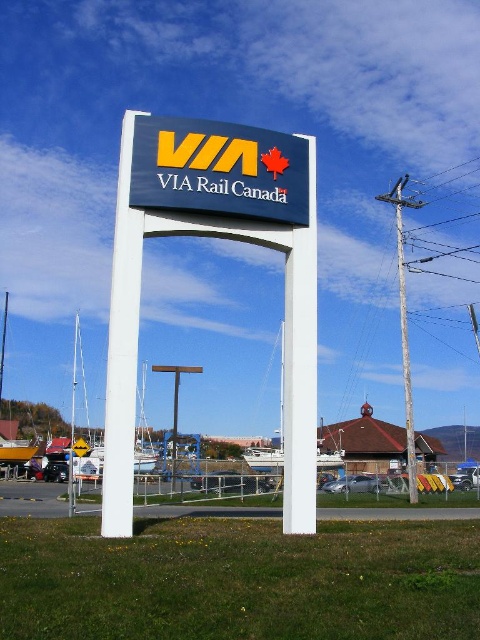
You are a photographer trying to capture the blue matte sign at center and the weathered wood utility pole at right in a single shot. Based on their positions, which object will appear closer to the camera in the photo?

The blue matte sign at center appears closer to the camera because it is positioned in front of the weathered wood utility pole at right.

You are standing at the entrance of the marina and see both the white plastic sign at center and the blue matte sign at center. If you want to reach the sign closer to you, which one should you walk towards?

The white plastic sign at center is 1.39 meters away from the blue matte sign at center. Since the white plastic sign is closer to you, you should walk towards the white plastic sign at center.